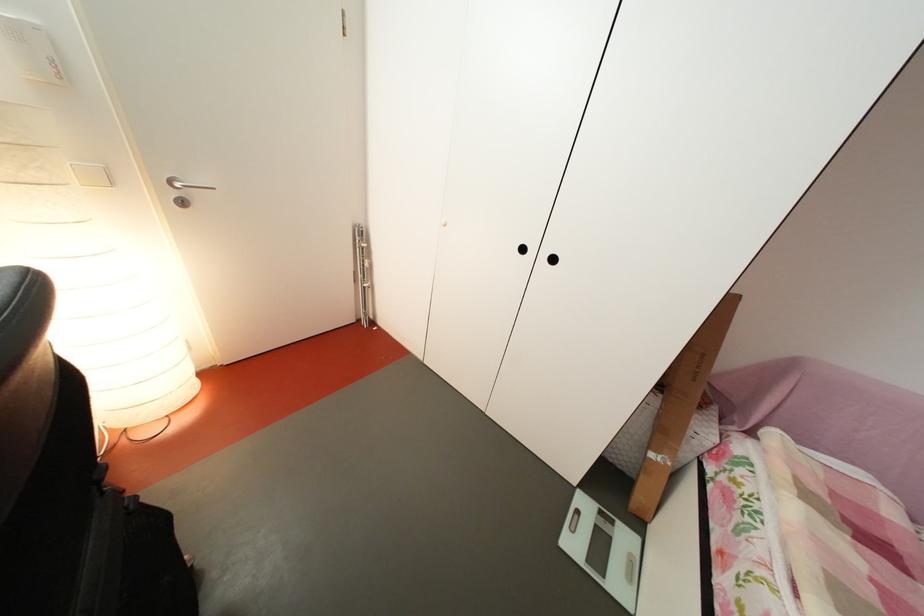
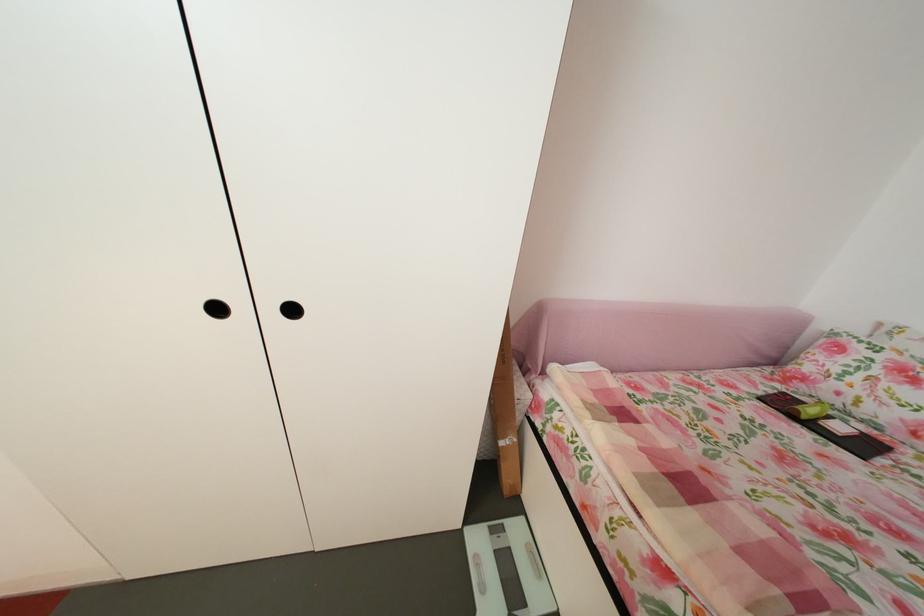
In the second image, find the point that corresponds to (613,519) in the first image.

(504, 537)